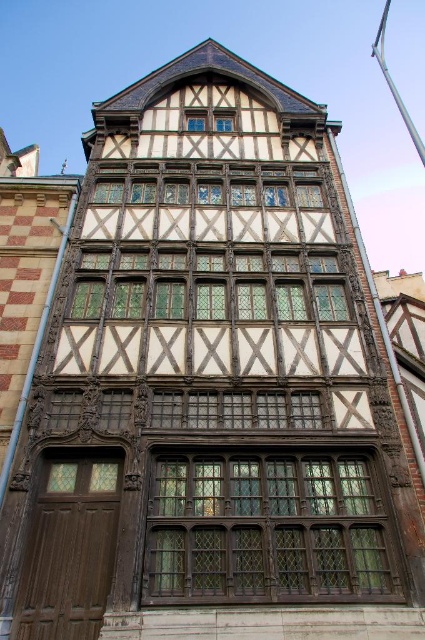
You are an architect designing a new building inspired by this traditional style. You need to decide which window to use between the wooden lattice window at center and the matte wood window at center. Which window has a greater width?

The wooden lattice window at center has a greater width than the matte wood window at center according to the description.

You are an architect analyzing the building in the image. You notice a point at coordinates (x=266, y=529). What architectural feature is located at this point?

The point at coordinates (x=266, y=529) indicates a wooden lattice window at center.